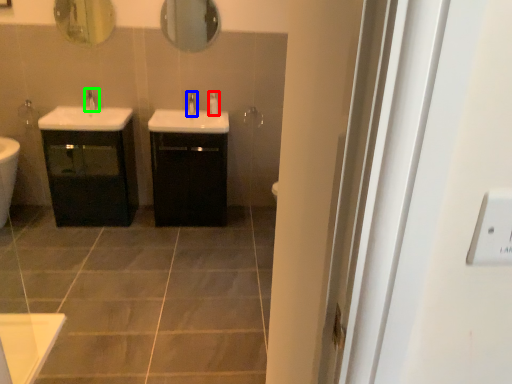
Question: Which object is the closest to the soap dispenser (highlighted by a red box)? Choose among these: tap (highlighted by a blue box) or tap (highlighted by a green box).

Choices:
 (A) tap
 (B) tap

Answer: (A)